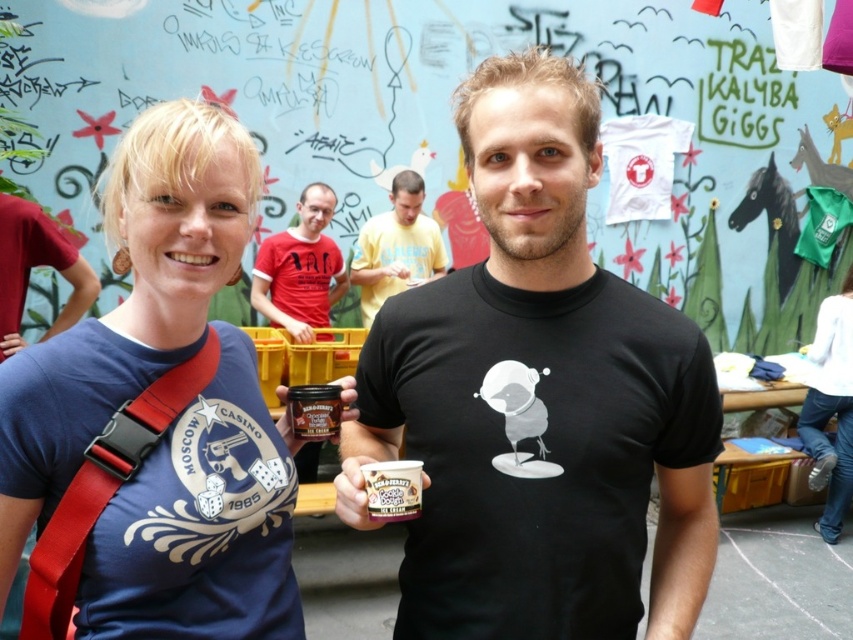
Question: Is black matte t-shirt at center smaller than white cotton shirt at center?

Choices:
 (A) yes
 (B) no

Answer: (A)

Question: Is yellow t-shirt at center below chocolate brown jar at center?

Choices:
 (A) no
 (B) yes

Answer: (A)

Question: Which point is farther to the camera?

Choices:
 (A) (375, 504)
 (B) (292, 243)

Answer: (B)

Question: Which point is closer to the camera?

Choices:
 (A) (824, 458)
 (B) (410, 484)
 (C) (173, 468)

Answer: (B)

Question: Among these objects, which one is farthest from the camera?

Choices:
 (A) blue printed t-shirt at upper left
 (B) white cotton shirt at center

Answer: (B)

Question: Can you confirm if white cotton shirt at center is thinner than smooth chocolate ice cream at center?

Choices:
 (A) yes
 (B) no

Answer: (B)